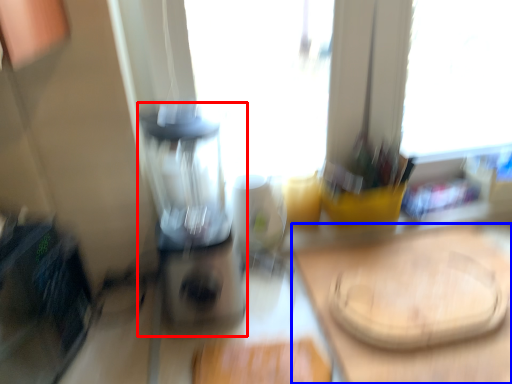
Question: Among these objects, which one is farthest to the camera, blender (highlighted by a red box) or counter top (highlighted by a blue box)?

Choices:
 (A) blender
 (B) counter top

Answer: (B)